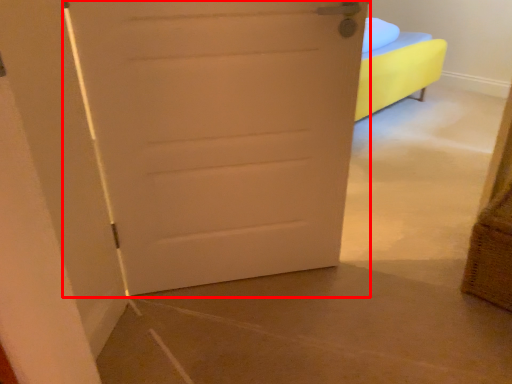
Question: From the image's perspective, what is the correct spatial relationship of door (annotated by the red box) in relation to basket?

Choices:
 (A) below
 (B) above

Answer: (B)